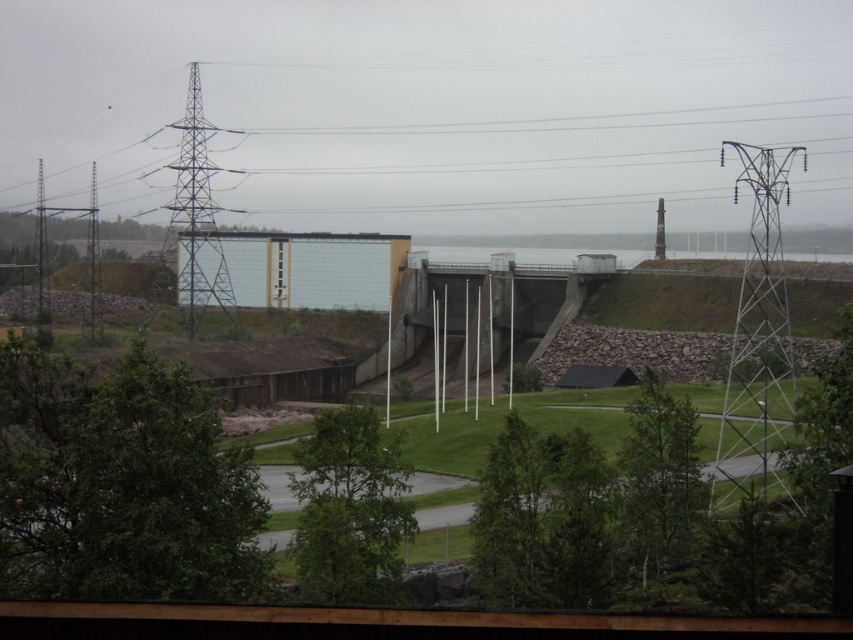
Can you confirm if metallic silver tower at right is bigger than metallic grid tower at left?

No, metallic silver tower at right is not bigger than metallic grid tower at left.

Does metallic silver tower at right appear on the right side of metallic grid tower at left?

Indeed, metallic silver tower at right is positioned on the right side of metallic grid tower at left.

In order to click on metallic silver tower at right in this screenshot , I will do `click(757, 342)`.

Which is above, metallic grid tower at left or smooth concrete tower at upper right?

metallic grid tower at left is higher up.

The image size is (853, 640). In order to click on metallic grid tower at left in this screenshot , I will do `click(194, 225)`.

Consider the image. Who is more forward, (195,196) or (659,214)?

Point (195,196)

Where is `metallic grid tower at left`? Image resolution: width=853 pixels, height=640 pixels. metallic grid tower at left is located at coordinates pyautogui.click(x=194, y=225).

Looking at this image, between metallic silver tower at right and smooth concrete tower at upper right, which one appears on the left side from the viewer's perspective?

From the viewer's perspective, metallic silver tower at right appears more on the left side.

Is point (773, 492) positioned before point (660, 252)?

Yes.

Image resolution: width=853 pixels, height=640 pixels. Identify the location of metallic silver tower at right. (757, 342).

Find the location of a particular element. metallic silver tower at right is located at coordinates (757, 342).